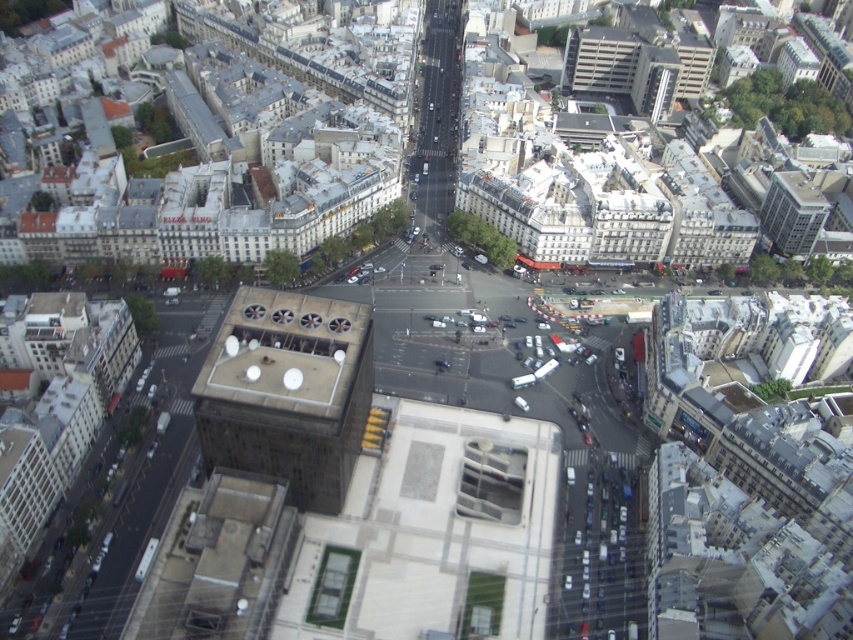
You are a delivery drone flying over the city. You need to land on the rooftop of the dark gray concrete building at center. However, there is a glassy reflective skyscraper at upper right in your flight path. Based on the scene, will the skyscraper block your direct path to the building?

The dark gray concrete building at center is closer to the viewer than the glassy reflective skyscraper at upper right, so the skyscraper will not block the direct path to the building.

Based on the photo, you are a delivery drone with a wingspan of 1.2 meters. You need to fly from the dark gray concrete building at center to the glassy reflective skyscraper at upper right. Is there enough space between these two buildings for your drone to pass through?

The distance between the dark gray concrete building at center and the glassy reflective skyscraper at upper right is 153.12 meters. Since the drone has a wingspan of 1.2 meters, there is ample space for it to pass through.

You are a delivery drone navigating an urban area. Your destination is the dark gray concrete building at center. Given the coordinates provided in the Objects Description, can you confirm if the building is positioned closer to the northern or southern part of the image?

The dark gray concrete building at center is located at coordinates point (287, 392). Since the y coordinate is 0.338, which is closer to 0.5, it is centrally positioned between the northern and southern parts of the image.